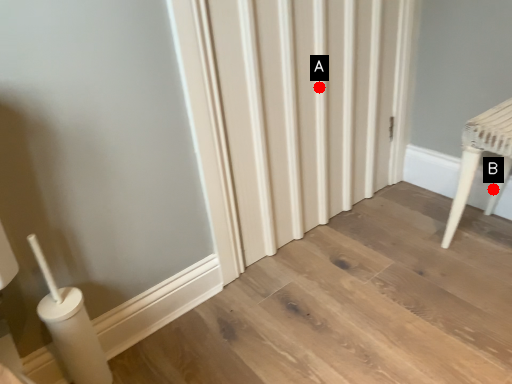
Question: Two points are circled on the image, labeled by A and B beside each circle. Which of the following is the farthest from the observer?

Choices:
 (A) A is further
 (B) B is further

Answer: (B)